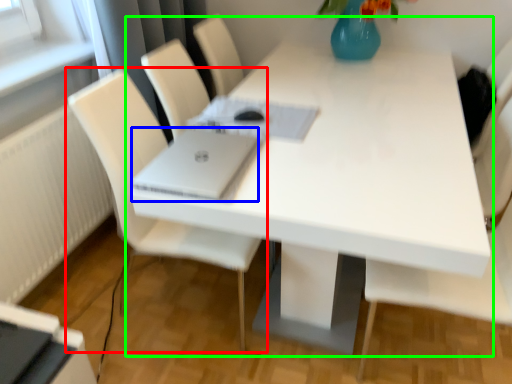
Question: Which is nearer to the chair (highlighted by a red box)? laptop (highlighted by a blue box) or table (highlighted by a green box).

Choices:
 (A) laptop
 (B) table

Answer: (A)